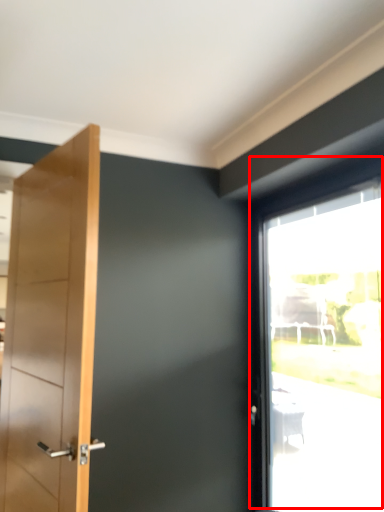
Question: From the image's perspective, considering the relative positions of window (annotated by the red box) and door in the image provided, where is window (annotated by the red box) located with respect to the staircase?

Choices:
 (A) above
 (B) below

Answer: (B)